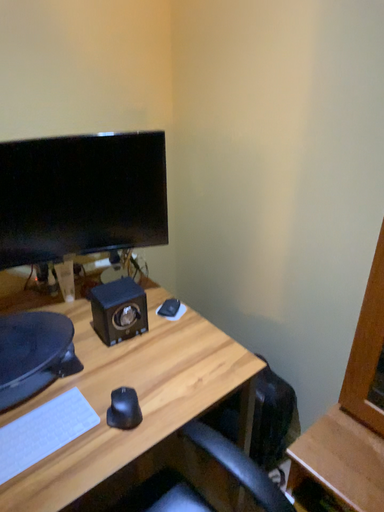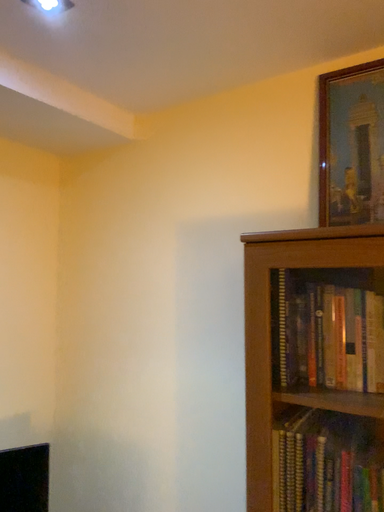
Question: How did the camera likely rotate when shooting the video?

Choices:
 (A) rotated right
 (B) rotated left

Answer: (A)